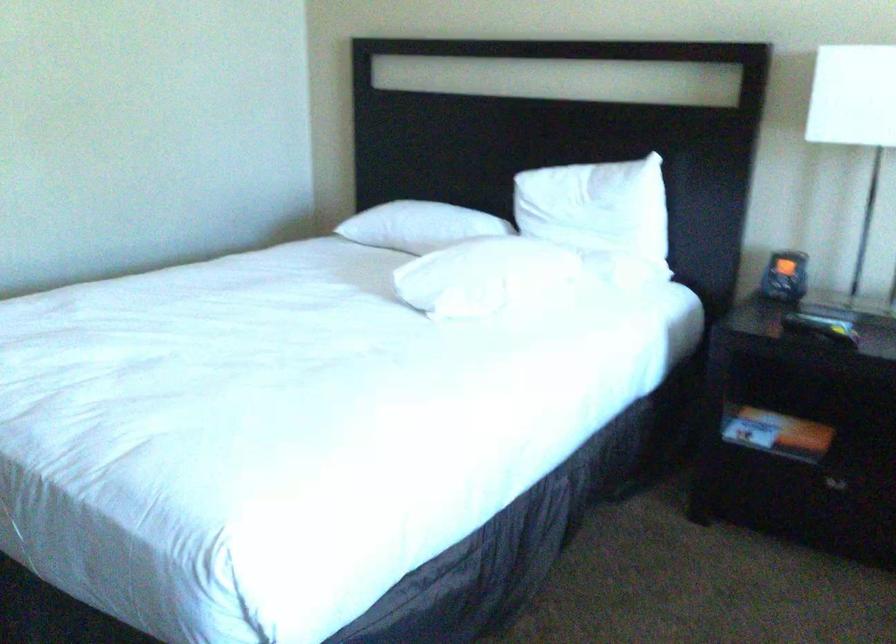
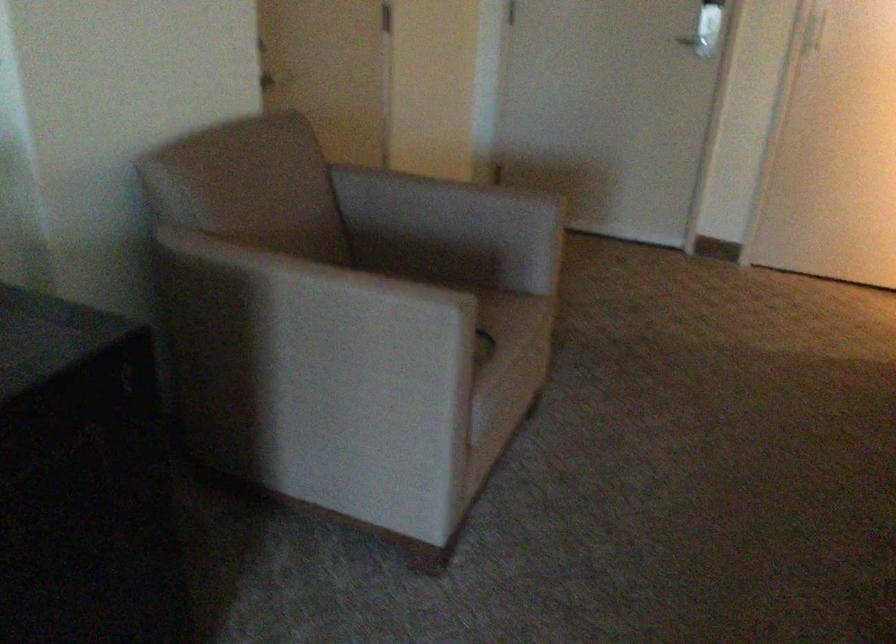
The images are taken continuously from a first-person perspective. In which direction is your viewpoint rotating?

The rotation direction of the camera is left-down.